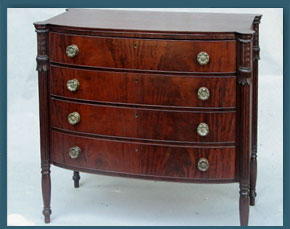
At what (x,y) coordinates should I click in order to perform the action: click on top of dresser. Please return your answer as a coordinate pair (x, y). Looking at the image, I should click on (153, 18).